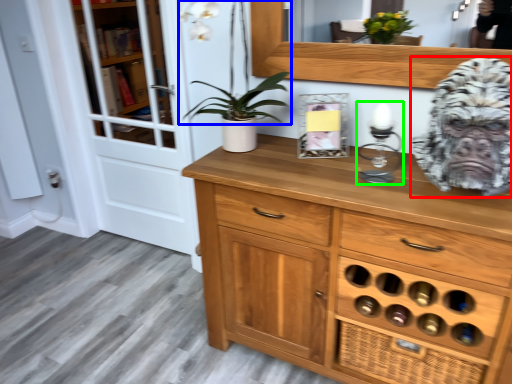
Question: Which object is positioned closest to gorilla (highlighted by a red box)? Select from plant (highlighted by a blue box) and candle holder (highlighted by a green box).

Choices:
 (A) plant
 (B) candle holder

Answer: (B)